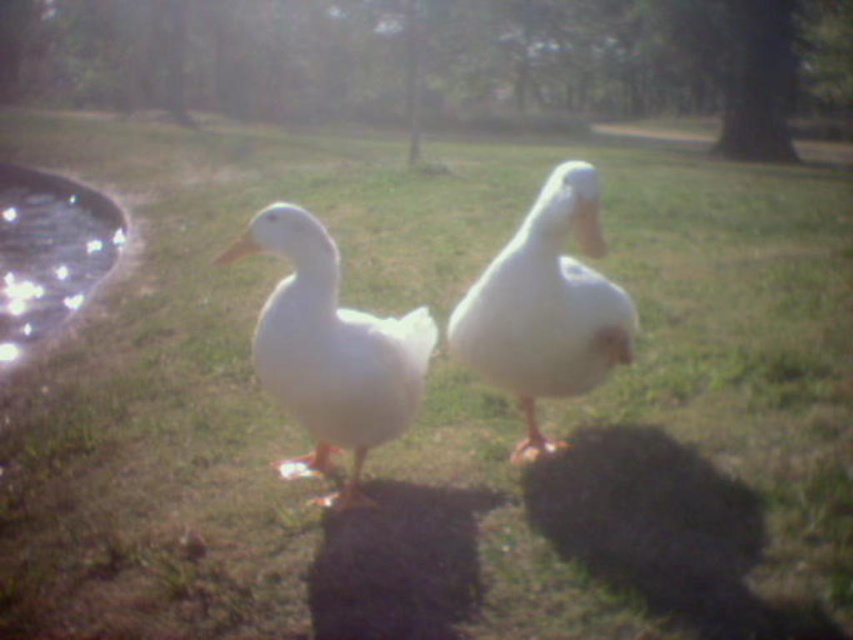
Can you confirm if white feathered duck at center is positioned above white matte duck at center?

No.

Between white feathered duck at center and white matte duck at center, which one has more height?

With more height is white matte duck at center.

This screenshot has height=640, width=853. Find the location of `white feathered duck at center`. white feathered duck at center is located at coordinates (329, 348).

Who is higher up, white matte duck at center or glistening glass pond at left?

glistening glass pond at left

Locate an element on the screen. white matte duck at center is located at coordinates (546, 307).

Between point (601, 248) and point (22, 333), which one is positioned behind?

Positioned behind is point (22, 333).

The height and width of the screenshot is (640, 853). Find the location of `white matte duck at center`. white matte duck at center is located at coordinates (546, 307).

Is white feathered duck at center below glistening glass pond at left?

Yes, white feathered duck at center is below glistening glass pond at left.

Between point (271, 346) and point (99, 252), which one is positioned behind?

The point (99, 252) is more distant.

Between point (334, 288) and point (56, 326), which one is positioned behind?

Positioned behind is point (56, 326).

Where is `white feathered duck at center`? The image size is (853, 640). white feathered duck at center is located at coordinates (329, 348).